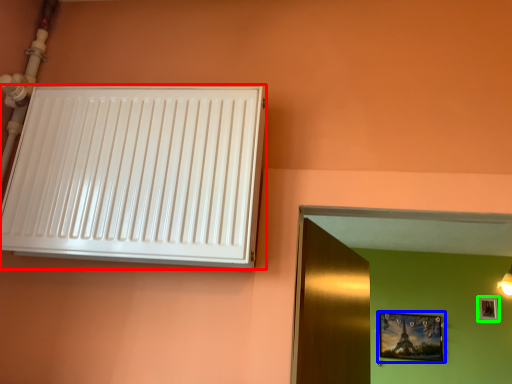
Question: Which is farther away from air conditioning (highlighted by a red box)? picture frame (highlighted by a blue box) or picture frame (highlighted by a green box)?

Choices:
 (A) picture frame
 (B) picture frame

Answer: (B)